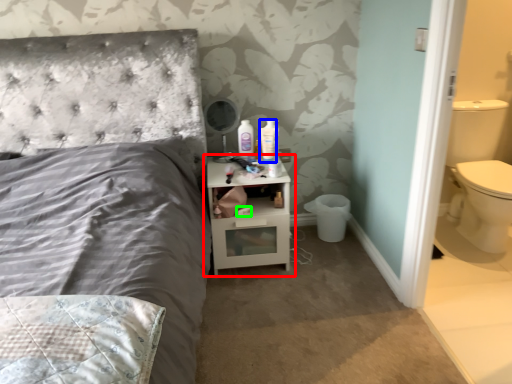
Question: Based on their relative distances, which object is nearer to nightstand (highlighted by a red box)? Choose from mouthwash (highlighted by a blue box) and toilet paper (highlighted by a green box).

Choices:
 (A) mouthwash
 (B) toilet paper

Answer: (B)